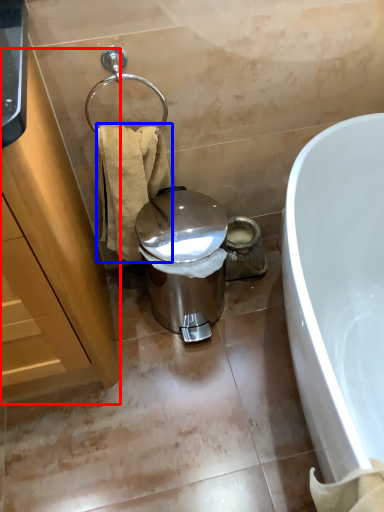
Question: Which object is closer to the camera taking this photo, cabinetry (highlighted by a red box) or towel/napkin (highlighted by a blue box)?

Choices:
 (A) cabinetry
 (B) towel/napkin

Answer: (A)